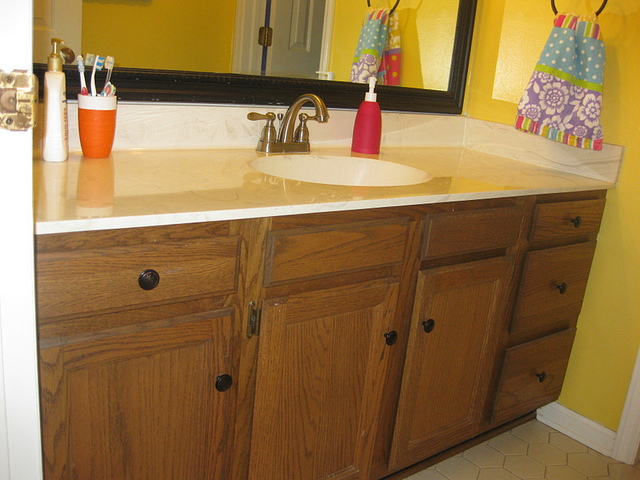
Locate an element on the screen. The image size is (640, 480). drawer is located at coordinates 571,223.